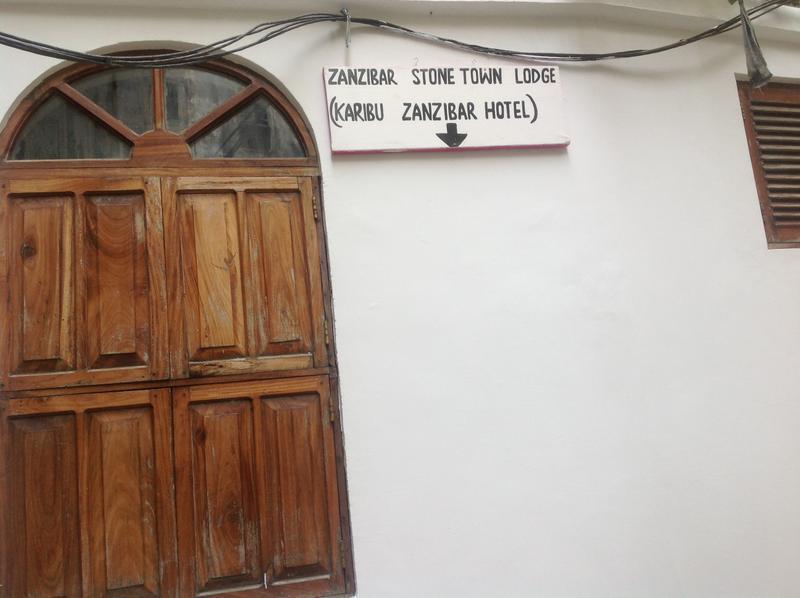
In order to click on door windows in this screenshot , I will do `click(74, 126)`, `click(118, 91)`, `click(189, 91)`, `click(245, 125)`, `click(196, 594)`.